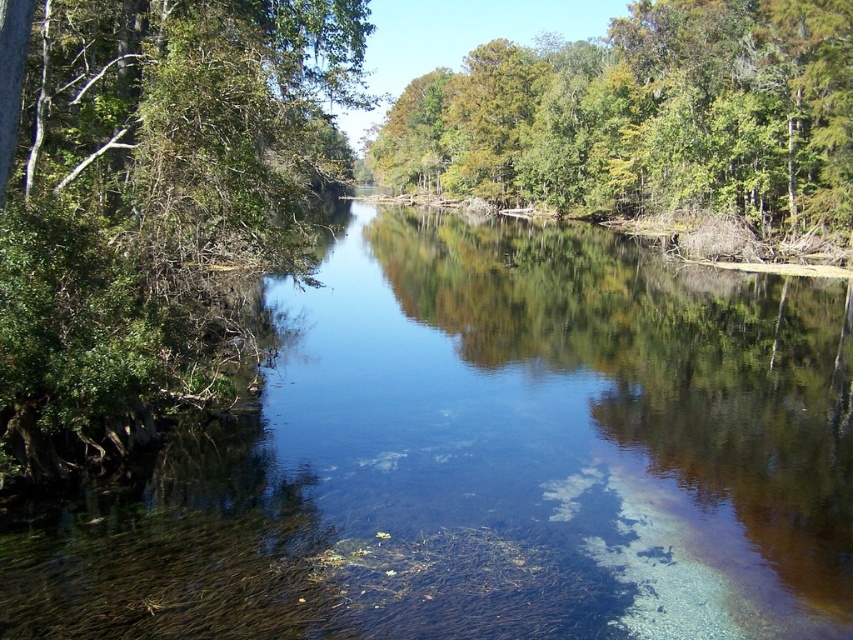
Question: Does clear water at center come in front of green leafy trees at upper center?

Choices:
 (A) no
 (B) yes

Answer: (B)

Question: Which of these objects is positioned farthest from the green leafy tree at left?

Choices:
 (A) clear water at center
 (B) green leafy trees at upper center

Answer: (B)

Question: Does clear water at center appear under green leafy tree at left?

Choices:
 (A) yes
 (B) no

Answer: (A)

Question: Which object is positioned farthest from the clear water at center?

Choices:
 (A) green leafy trees at upper center
 (B) green leafy tree at left

Answer: (A)

Question: Which point is closer to the camera?

Choices:
 (A) (152, 333)
 (B) (712, 154)

Answer: (A)

Question: Is clear water at center closer to the viewer compared to green leafy tree at left?

Choices:
 (A) yes
 (B) no

Answer: (A)